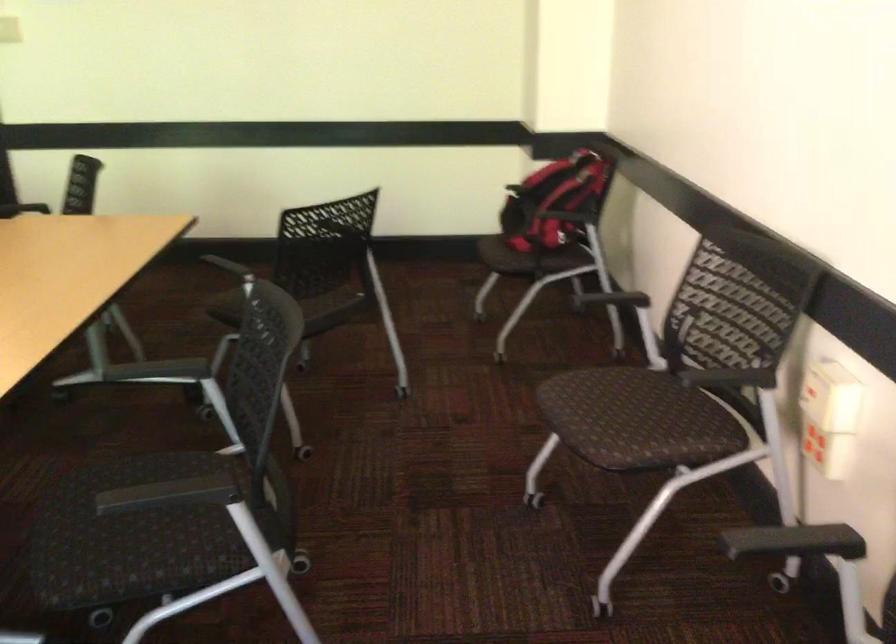
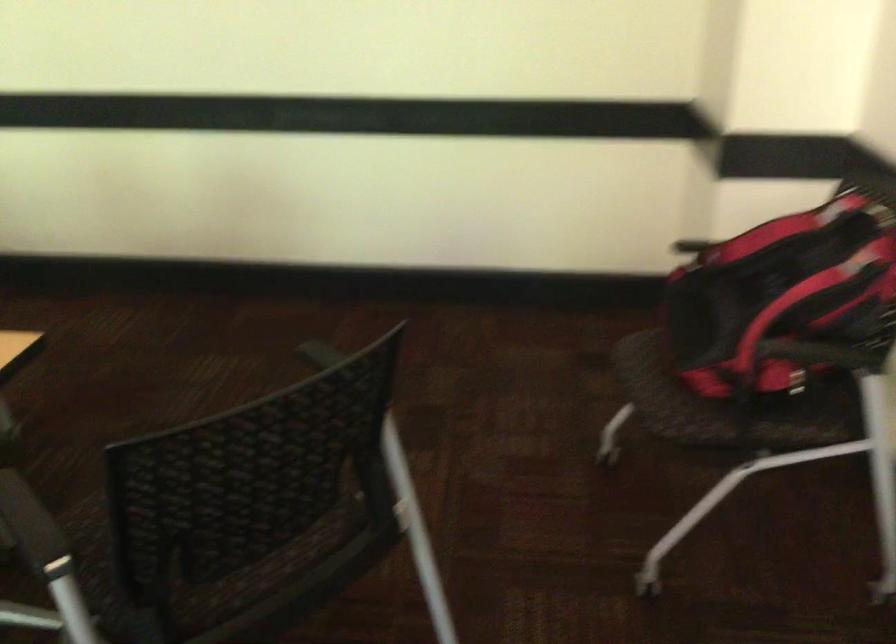
Question: Which direction would the cameraman need to move to produce the second image? Reply with the corresponding letter.

Choices:
 (A) Left
 (B) Right
 (C) Forward
 (D) Backward

Answer: (C)